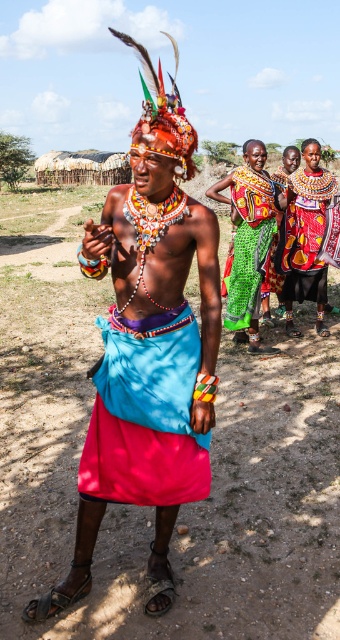
Question: In this image, where is shiny fabric skirt at center located relative to shiny red skirt at center?

Choices:
 (A) above
 (B) below

Answer: (B)

Question: Estimate the real-world distances between objects in this image. Which object is closer to the shiny fabric skirt at center?

Choices:
 (A) shiny multicolored headdress at center
 (B) shiny red skirt at center

Answer: (A)

Question: Which point is closer to the camera?

Choices:
 (A) shiny fabric skirt at center
 (B) shiny multicolored headdress at center
 (C) shiny red skirt at center

Answer: (B)

Question: Which object is farther from the camera taking this photo?

Choices:
 (A) green woven skirt at center
 (B) shiny multicolored headdress at center
 (C) shiny red skirt at center
 (D) shiny fabric skirt at center

Answer: (C)

Question: Can you confirm if shiny fabric skirt at center is positioned to the left of shiny red skirt at center?

Choices:
 (A) no
 (B) yes

Answer: (B)

Question: Can you confirm if shiny fabric skirt at center is smaller than green woven skirt at center?

Choices:
 (A) yes
 (B) no

Answer: (A)